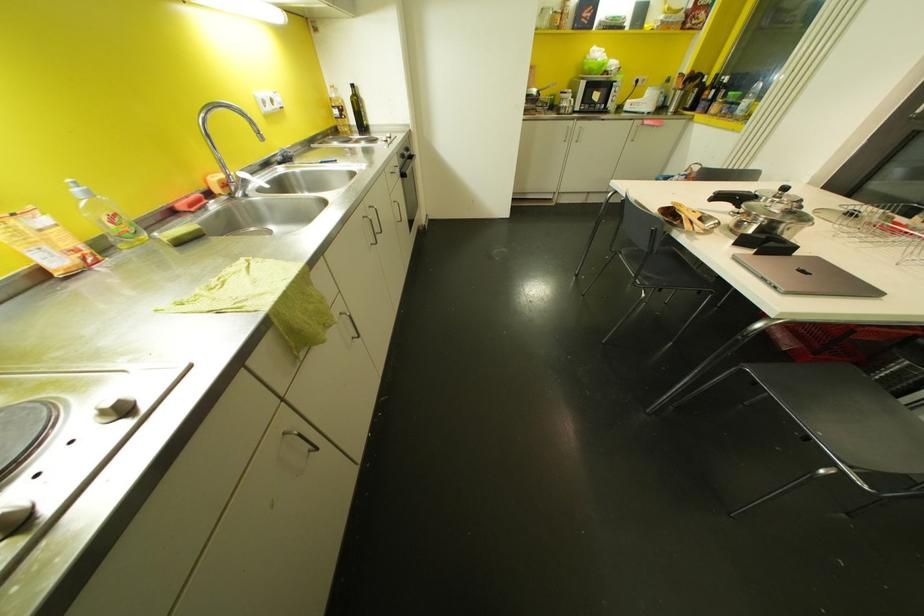
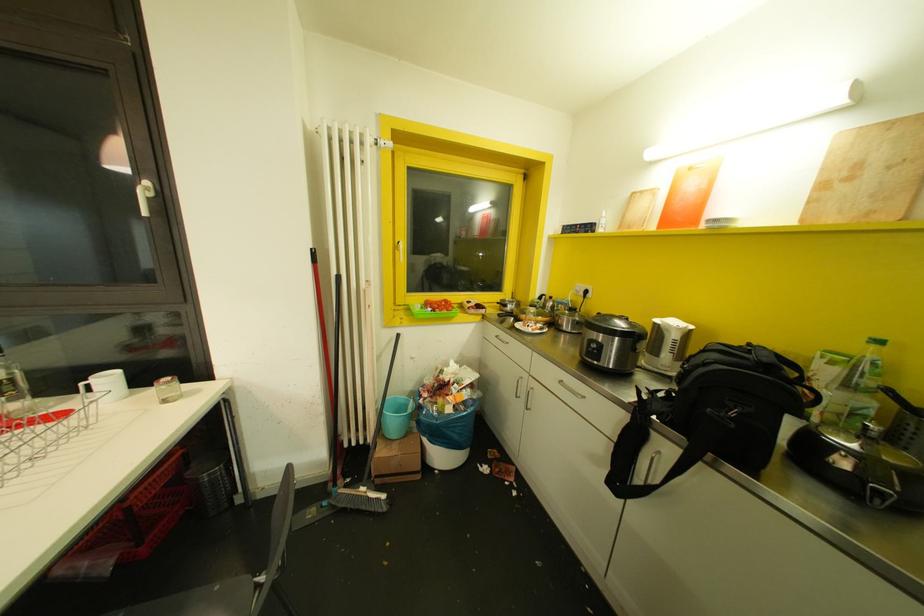
How did the camera likely rotate?

The rotation direction of the camera is right-down.